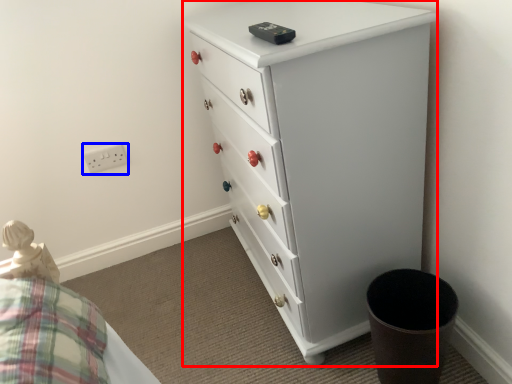
Question: Which object appears closest to the camera in this image, chest of drawers (highlighted by a red box) or electric outlet (highlighted by a blue box)?

Choices:
 (A) chest of drawers
 (B) electric outlet

Answer: (A)